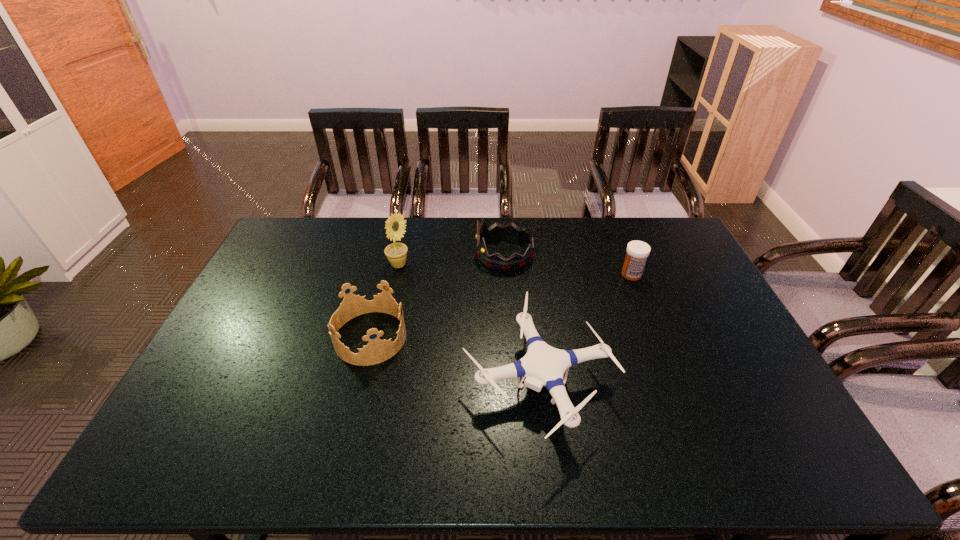
Locate an element on the screen. the tallest object is located at coordinates click(396, 253).

Find the location of a particular element. This screenshot has width=960, height=540. the farther tiara is located at coordinates (497, 231).

Locate an element on the screen. the left tiara is located at coordinates (x=377, y=351).

Identify the location of medicine. (637, 251).

Where is `drone`? The width and height of the screenshot is (960, 540). drone is located at coordinates (543, 365).

Find the location of a particular element. This screenshot has width=960, height=540. vacant space located on the face of the tallest object is located at coordinates (450, 266).

The image size is (960, 540). I want to click on vacant space located 0.300m at the front of the farther tiara with jewels, so click(x=393, y=254).

Identify the location of vacant area located at the front of the farther tiara with jewels. The width and height of the screenshot is (960, 540). (420, 254).

Locate an element on the screen. Image resolution: width=960 pixels, height=540 pixels. free region located at the front of the farther tiara with jewels is located at coordinates (368, 254).

You are a GUI agent. You are given a task and a screenshot of the screen. Output one action in this format:
    pyautogui.click(x=<x>, y=<y>)
    Task: Click on the free space located 0.170m on the front-facing side of the left tiara
    The image size is (960, 540).
    Given the screenshot: What is the action you would take?
    pyautogui.click(x=464, y=338)